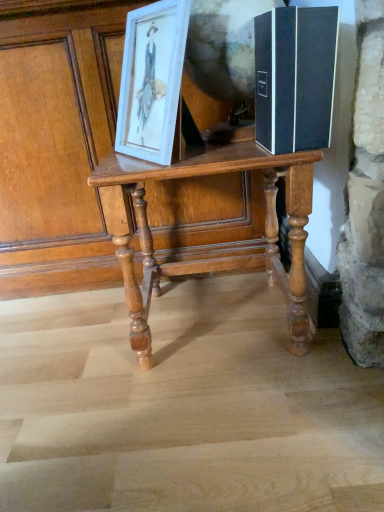
Question: Visually, is white wood picture frame at upper left positioned to the left or to the right of black matte book at right?

Choices:
 (A) left
 (B) right

Answer: (A)

Question: In terms of height, does white wood picture frame at upper left look taller or shorter compared to black matte book at right?

Choices:
 (A) short
 (B) tall

Answer: (B)

Question: Which object is the closest to the white wood picture frame at upper left?

Choices:
 (A) black matte book at right
 (B) wooden table at center

Answer: (A)

Question: Which object is the farthest from the black matte book at right?

Choices:
 (A) white wood picture frame at upper left
 (B) wooden table at center

Answer: (B)